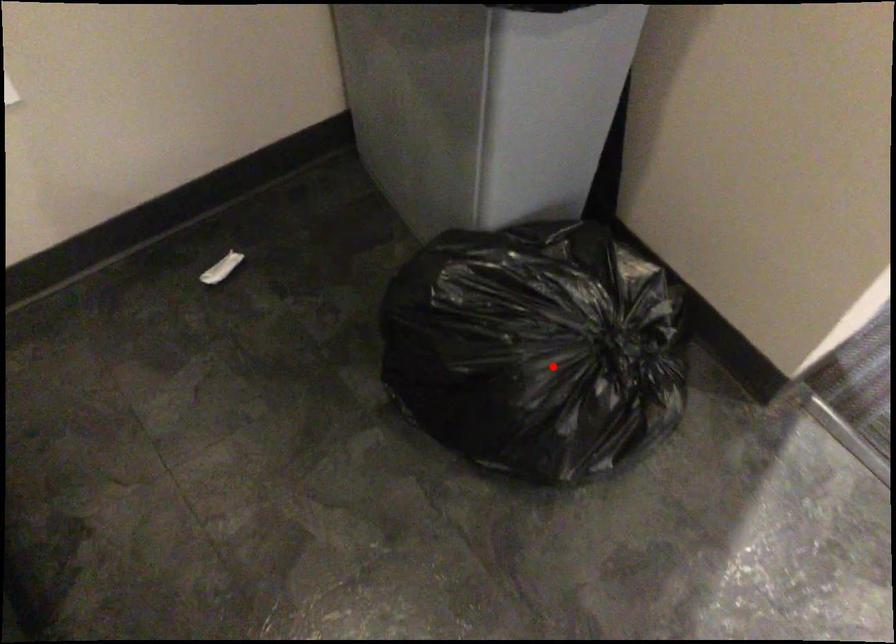
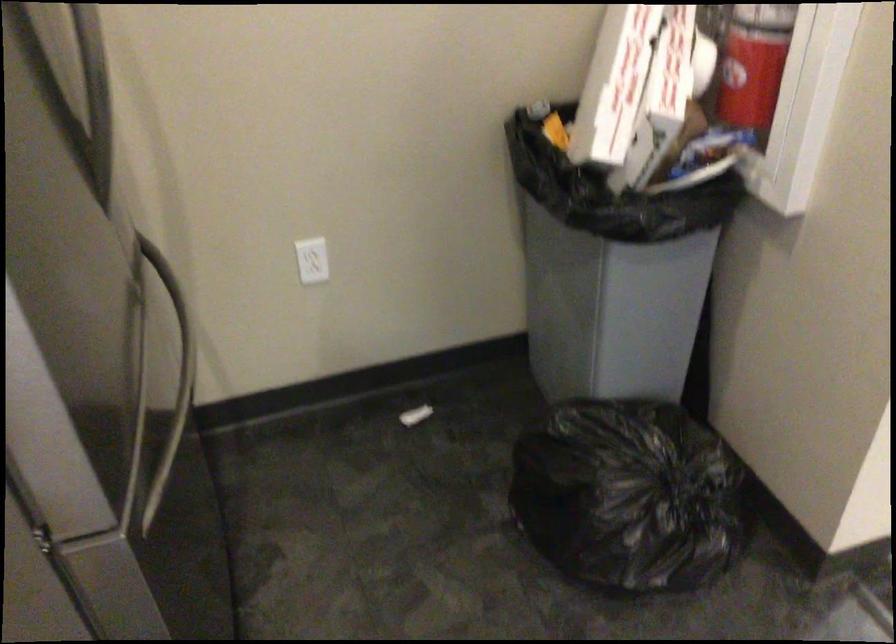
Find the pixel in the second image that matches the highlighted location in the first image.

(629, 496)